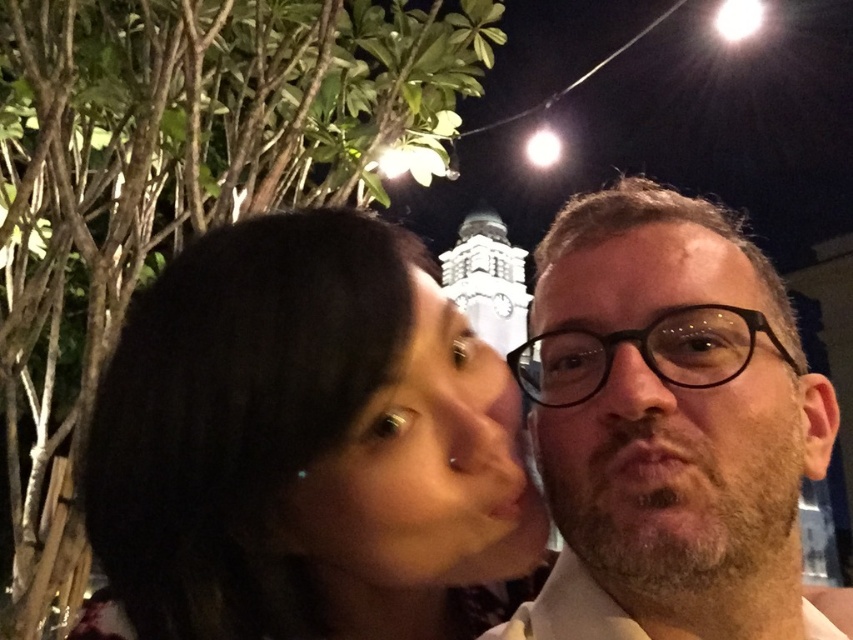
Based on the photo, can you confirm if beige textured shirt at center is positioned below black plastic glasses at center?

Correct, beige textured shirt at center is located below black plastic glasses at center.

Is point (749, 524) less distant than point (659, 372)?

Yes.

Find the location of a particular element. beige textured shirt at center is located at coordinates (668, 426).

Can you confirm if smooth skin face at center is bigger than black plastic glasses at center?

No.

Consider the image. Measure the distance between point (473, 568) and camera.

Point (473, 568) and camera are 63.32 meters apart.

Find the location of a particular element. This screenshot has width=853, height=640. smooth skin face at center is located at coordinates (424, 468).

Is beige textured shirt at center above smooth skin face at center?

Correct, beige textured shirt at center is located above smooth skin face at center.

Is point (767, 368) in front of point (496, 461)?

That is True.

Where is `beige textured shirt at center`? beige textured shirt at center is located at coordinates (668, 426).

Where is `beige textured shirt at center`? Image resolution: width=853 pixels, height=640 pixels. beige textured shirt at center is located at coordinates (668, 426).